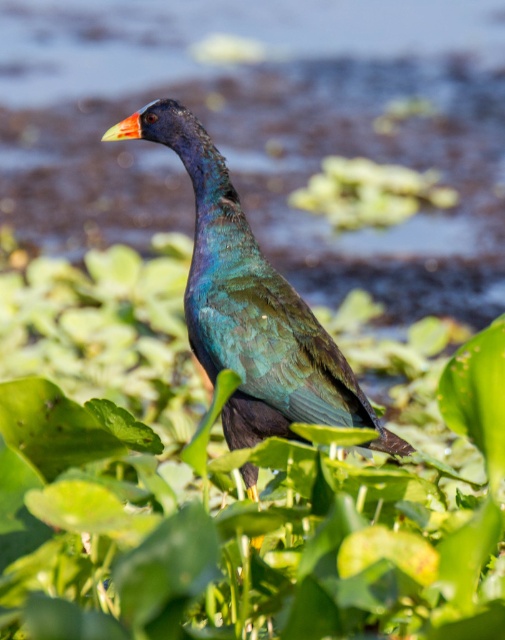
You are a photographer trying to capture the metallic iridescent bird at center and the green leafy plant at center in a single frame. Based on their positions, which object should you adjust your camera focus to first to ensure both are in the frame?

The green leafy plant at center is positioned on the left side of metallic iridescent bird at center. To capture both in a single frame, adjust focus to the green leafy plant at center first since it is closer to the left edge, ensuring the metallic iridescent bird at center remains within the frame.

You are a photographer trying to capture the metallic iridescent bird at center and the green leafy plant at center in the same frame. Based on the scene, which object is wider and might require adjusting your camera angle to fit both?

The green leafy plant at center might be wider than the metallic iridescent bird at center, so you should adjust your camera angle to ensure both fit in the frame.